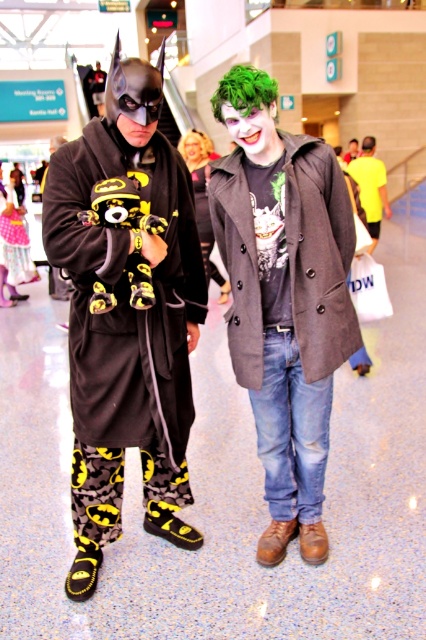
Which is more to the right, green matte wig at center or denim jeans at center?

Positioned to the right is green matte wig at center.

I want to click on green matte wig at center, so click(284, 298).

At what (x,y) coordinates should I click in order to perform the action: click on green matte wig at center. Please return your answer as a coordinate pair (x, y). Looking at the image, I should click on click(x=284, y=298).

Based on the photo, does yellow t-shirt at right have a greater width compared to yellowplush toy at left?

Yes.

Does yellow t-shirt at right have a greater height compared to yellowplush toy at left?

Indeed, yellow t-shirt at right has a greater height compared to yellowplush toy at left.

This screenshot has height=640, width=426. Find the location of `yellow t-shirt at right`. yellow t-shirt at right is located at coordinates (371, 188).

Is green matte wig at center to the right of yellowplush toy at left from the viewer's perspective?

Indeed, green matte wig at center is positioned on the right side of yellowplush toy at left.

How far apart are green matte wig at center and yellowplush toy at left?

green matte wig at center is 5.34 meters away from yellowplush toy at left.

This screenshot has width=426, height=640. What do you see at coordinates (284, 298) in the screenshot?
I see `green matte wig at center` at bounding box center [284, 298].

You are a GUI agent. You are given a task and a screenshot of the screen. Output one action in this format:
    pyautogui.click(x=<x>, y=<y>)
    Task: Click on the green matte wig at center
    The height and width of the screenshot is (640, 426).
    Given the screenshot: What is the action you would take?
    pyautogui.click(x=284, y=298)